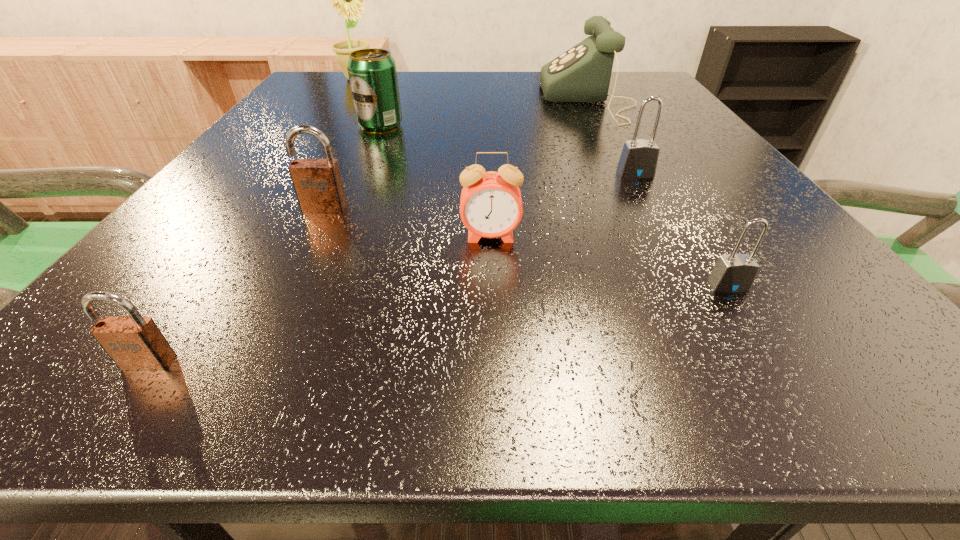
The height and width of the screenshot is (540, 960). I want to click on the smaller gray padlock, so click(x=732, y=273).

The image size is (960, 540). Find the location of `the second nearest object`. the second nearest object is located at coordinates (732, 273).

Where is `the leftmost padlock`? the leftmost padlock is located at coordinates (134, 343).

Locate an element on the screen. The image size is (960, 540). the nearest object is located at coordinates (134, 343).

In order to click on vacant region located on the face of the yellow sunflower in this screenshot , I will do `click(409, 79)`.

Where is `vacant area situated on the dial of the telephone`? The image size is (960, 540). vacant area situated on the dial of the telephone is located at coordinates (367, 100).

You are a GUI agent. You are given a task and a screenshot of the screen. Output one action in this format:
    pyautogui.click(x=<x>, y=<y>)
    Task: Click on the vacant area situated 0.370m on the dial of the telephone
    The width and height of the screenshot is (960, 540).
    Given the screenshot: What is the action you would take?
    pyautogui.click(x=372, y=100)

Locate an element on the screen. The height and width of the screenshot is (540, 960). free space located 0.070m on the dial of the telephone is located at coordinates (512, 100).

The image size is (960, 540). I want to click on vacant region located 0.280m on the back of the beer can, so click(402, 73).

Locate an element on the screen. The height and width of the screenshot is (540, 960). vacant space located 0.260m on the shackle of the farther gray padlock is located at coordinates (701, 292).